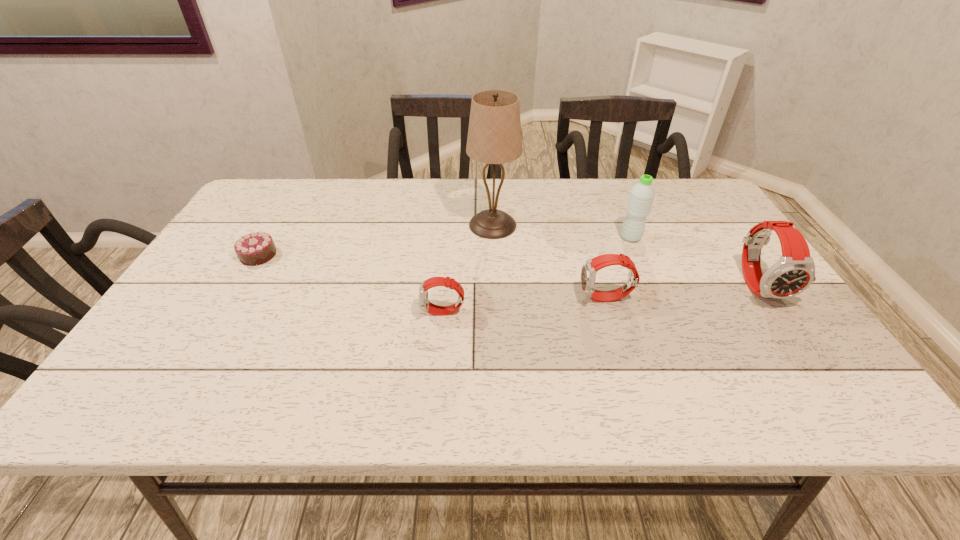
Identify which object is the third closest to the water bottle. Please provide its 2D coordinates. Your answer should be formatted as a tuple, i.e. [(x, y)], where the tuple contains the x and y coordinates of a point satisfying the conditions above.

[(494, 137)]

Locate which object is the closest to the third shortest object. Please provide its 2D coordinates. Your answer should be formatted as a tuple, i.e. [(x, y)], where the tuple contains the x and y coordinates of a point satisfying the conditions above.

[(642, 194)]

At what (x,y) coordinates should I click in order to perform the action: click on the closest watch to the shortest watch. Please return your answer as a coordinate pair (x, y). This screenshot has height=540, width=960. Looking at the image, I should click on (589, 269).

Select which watch appears as the closest to the rightmost object. Please provide its 2D coordinates. Your answer should be formatted as a tuple, i.e. [(x, y)], where the tuple contains the x and y coordinates of a point satisfying the conditions above.

[(589, 269)]

Identify the location of blank space that satisfies the following two spatial constraints: 1. on the front-facing side of the water bottle; 2. on the left side of the tallest object. (493, 238).

Where is `blank space that satisfies the following two spatial constraints: 1. on the front-facing side of the lampshade; 2. on the back side of the water bottle`? The image size is (960, 540). blank space that satisfies the following two spatial constraints: 1. on the front-facing side of the lampshade; 2. on the back side of the water bottle is located at coordinates (493, 238).